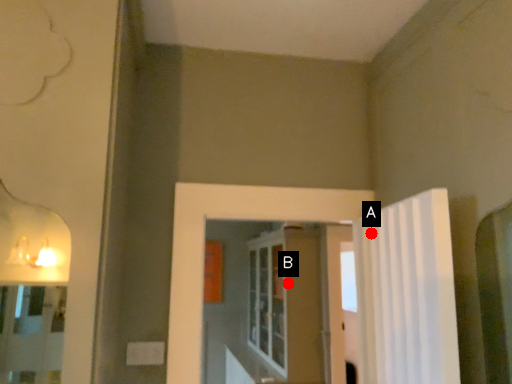
Question: Two points are circled on the image, labeled by A and B beside each circle. Among these points, which one is nearest to the camera?

Choices:
 (A) A is closer
 (B) B is closer

Answer: (A)